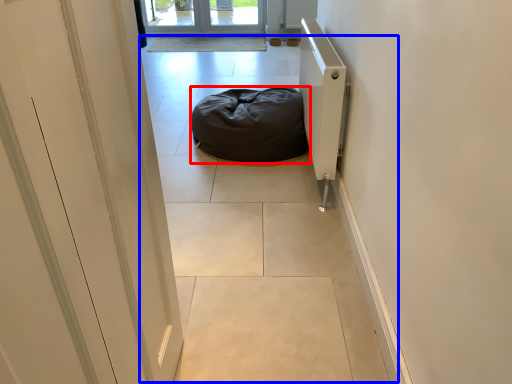
Question: Which of the following is the closest to the observer, furniture (highlighted by a red box) or path (highlighted by a blue box)?

Choices:
 (A) furniture
 (B) path

Answer: (B)